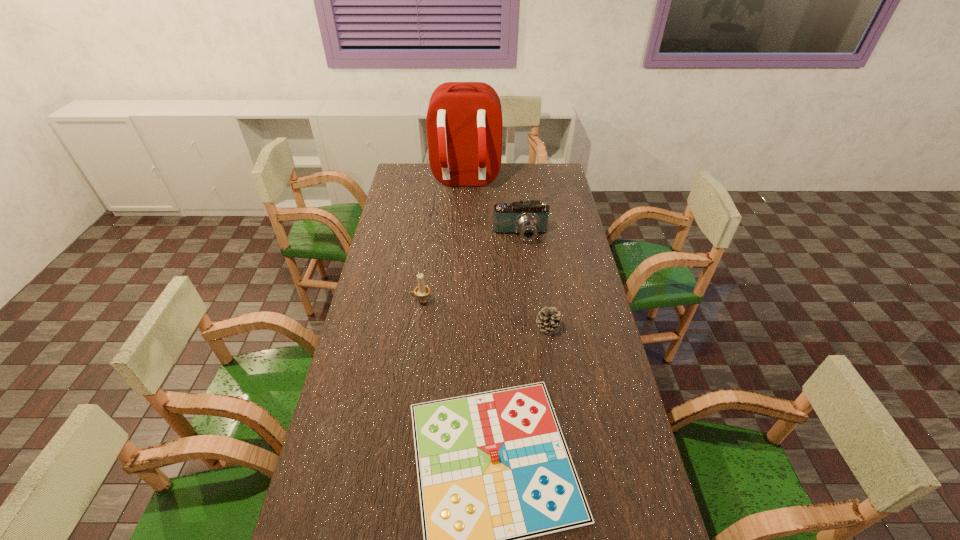
Find the location of a particular element. This screenshot has height=540, width=960. the farthest object is located at coordinates (464, 125).

This screenshot has height=540, width=960. In order to click on the tallest object in this screenshot , I will do tap(464, 125).

You are a GUI agent. You are given a task and a screenshot of the screen. Output one action in this format:
    pyautogui.click(x=<x>, y=<y>)
    Task: Click on the camcorder
    The image size is (960, 540).
    Given the screenshot: What is the action you would take?
    [530, 218]

You are a GUI agent. You are given a task and a screenshot of the screen. Output one action in this format:
    pyautogui.click(x=<x>, y=<y>)
    Task: Click on the candle_holder
    This screenshot has height=540, width=960.
    Given the screenshot: What is the action you would take?
    pyautogui.click(x=422, y=290)

The image size is (960, 540). Find the location of `the second nearest object`. the second nearest object is located at coordinates (549, 319).

Identify the location of the fourth tallest object. This screenshot has height=540, width=960. (549, 319).

This screenshot has width=960, height=540. I want to click on free space located on the strap side of the tallest object, so click(x=463, y=205).

Locate an element on the screen. Image resolution: width=960 pixels, height=540 pixels. vacant region located 0.360m on the front-facing side of the second farthest object is located at coordinates (529, 309).

What are the coordinates of `free space located on the handle side of the third farthest object` in the screenshot? It's located at (365, 301).

You are a GUI agent. You are given a task and a screenshot of the screen. Output one action in this format:
    pyautogui.click(x=<x>, y=<y>)
    Task: Click on the blank space located on the handle side of the third farthest object
    The image size is (960, 540).
    Given the screenshot: What is the action you would take?
    pyautogui.click(x=390, y=301)